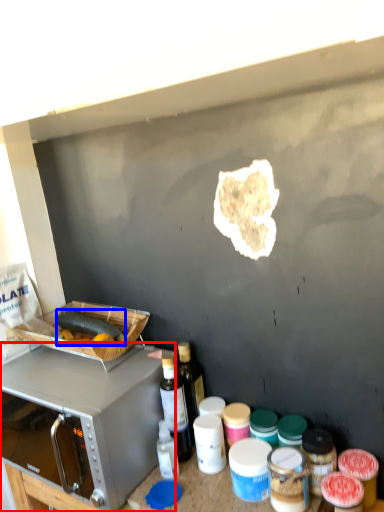
Question: Among these objects, which one is nearest to the camera, microwave oven (highlighted by a red box) or food (highlighted by a blue box)?

Choices:
 (A) microwave oven
 (B) food

Answer: (A)